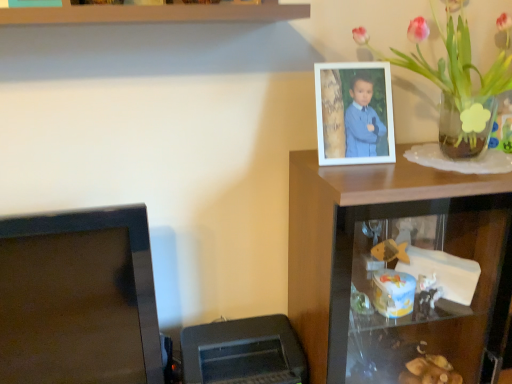
Question: Looking at their shapes, would you say white matte picture frame at upper right is wider or thinner than black plastic printer at lower left?

Choices:
 (A) thin
 (B) wide

Answer: (A)

Question: Which is correct: white matte picture frame at upper right is inside black plastic printer at lower left, or outside of it?

Choices:
 (A) outside
 (B) inside

Answer: (A)

Question: Estimate the real-world distances between objects in this image. Which object is closer to the satin black monitor at lower left?

Choices:
 (A) translucent glass vase at upper right
 (B) wooden shelf at upper right
 (C) white matte picture frame at upper right
 (D) black plastic printer at lower left

Answer: (D)

Question: Which of these objects is positioned farthest from the satin black monitor at lower left?

Choices:
 (A) black plastic printer at lower left
 (B) translucent glass vase at upper right
 (C) wooden shelf at upper right
 (D) white matte picture frame at upper right

Answer: (B)